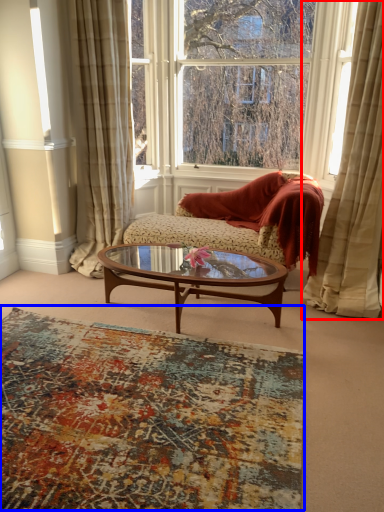
Question: Which object is closer to the camera taking this photo, curtain (highlighted by a red box) or plain (highlighted by a blue box)?

Choices:
 (A) curtain
 (B) plain

Answer: (B)